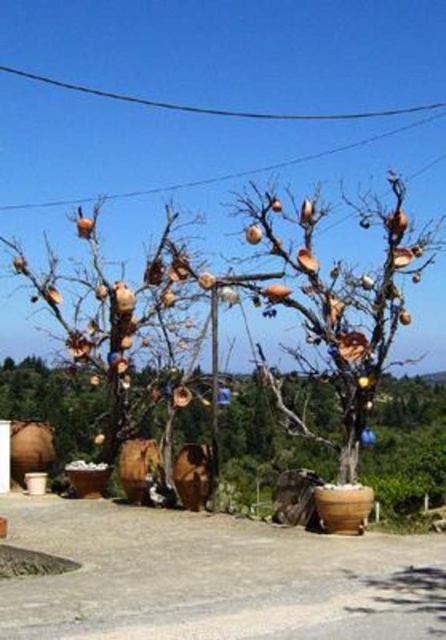
You are standing at the origin point of the coordinate system in the image. Where is the matte ceramic tree at center located?

The matte ceramic tree at center is located at point [338,307].

From the picture: You are an artist planning to install a new sculpture between the matte brown tree at left and the black wire at upper center. Based on their positions, where should you place the sculpture so it is between them?

The matte brown tree at left is located below the black wire at upper center, so placing the sculpture between them would require positioning it above the matte brown tree at left but below the black wire at upper center.

You are standing at the center of the image and want to walk towards the point labeled as point [132,333]. Which direction should you head?

The point [132,333] is on the matte brown tree at left, so you should head to the left to reach it.